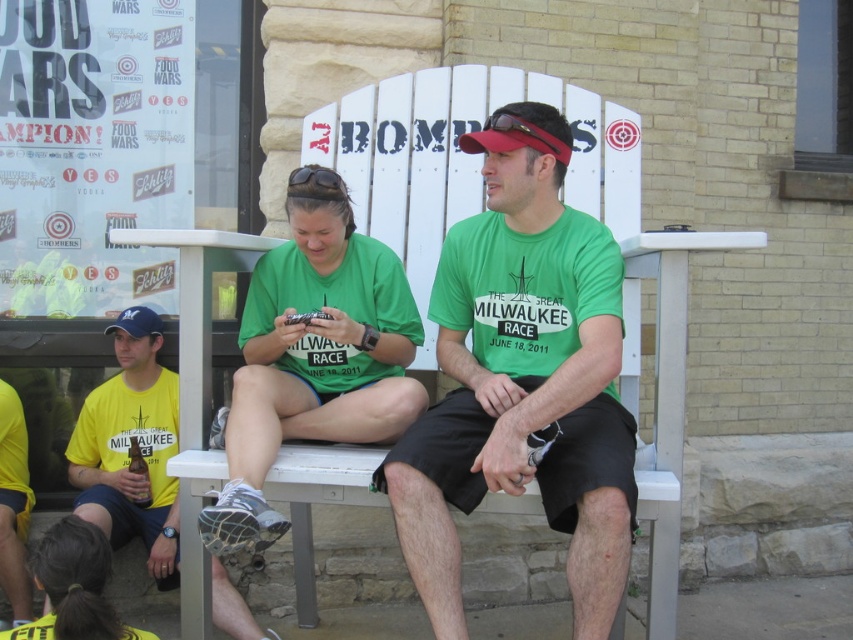
Is green cotton shirt at center to the left of yellow matte shirt at left from the viewer's perspective?

Incorrect, green cotton shirt at center is not on the left side of yellow matte shirt at left.

Is point (618, 344) closer to camera compared to point (134, 401)?

Yes, point (618, 344) is in front of point (134, 401).

Where is `green cotton shirt at center`? Image resolution: width=853 pixels, height=640 pixels. green cotton shirt at center is located at coordinates (521, 380).